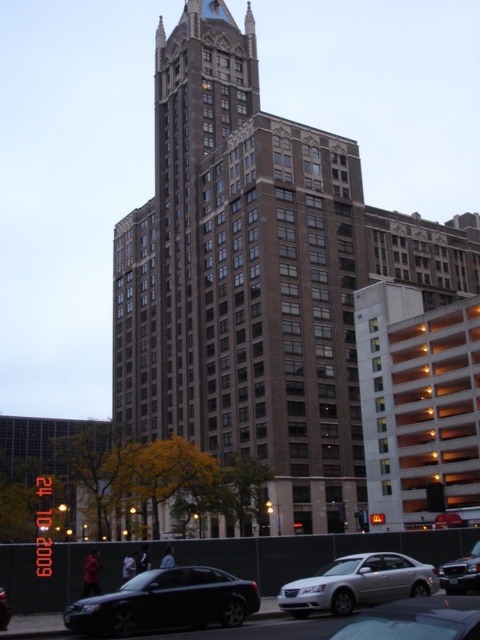
You are a parking attendant who needs to fit a car into a parking spot that can only accommodate vehicles up to the width of the shiny black sedan at center. Can the silver metallic sedan at lower center fit into this spot?

The silver metallic sedan at lower center has a larger width than the shiny black sedan at center, so it cannot fit into the parking spot designated for vehicles up to the width of the shiny black sedan at center.